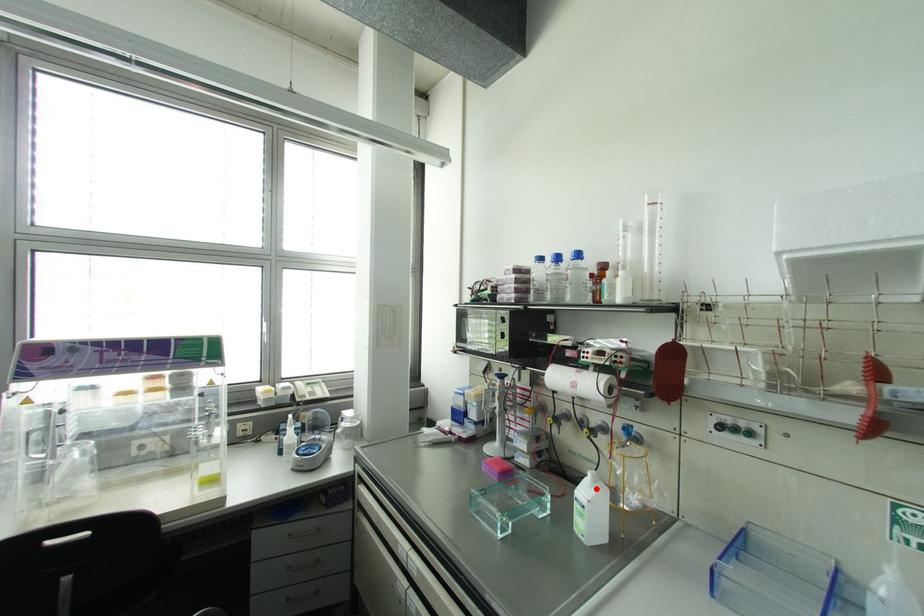
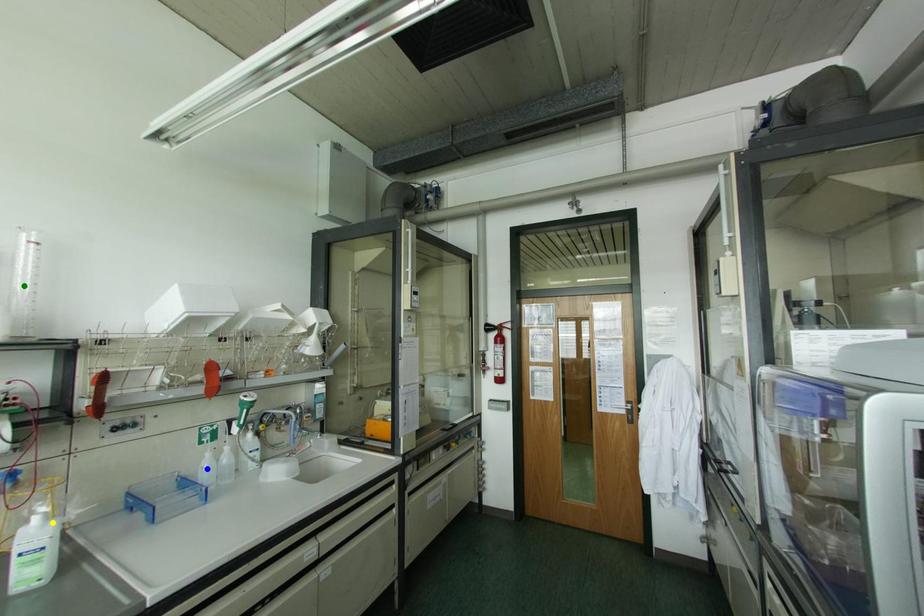
Question: I am providing you with two images of the same scene from different viewpoints. A red point is marked on the first image. You are given multiple points on the second image. Which point in image 2 represents the same 3d spot as the red point in image 1?

Choices:
 (A) blue point
 (B) green point
 (C) yellow point

Answer: (C)